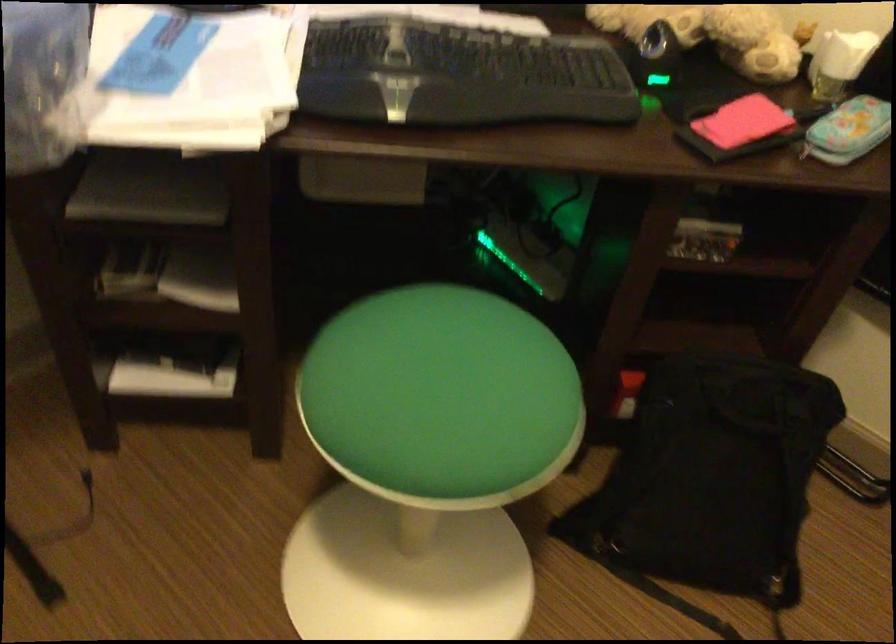
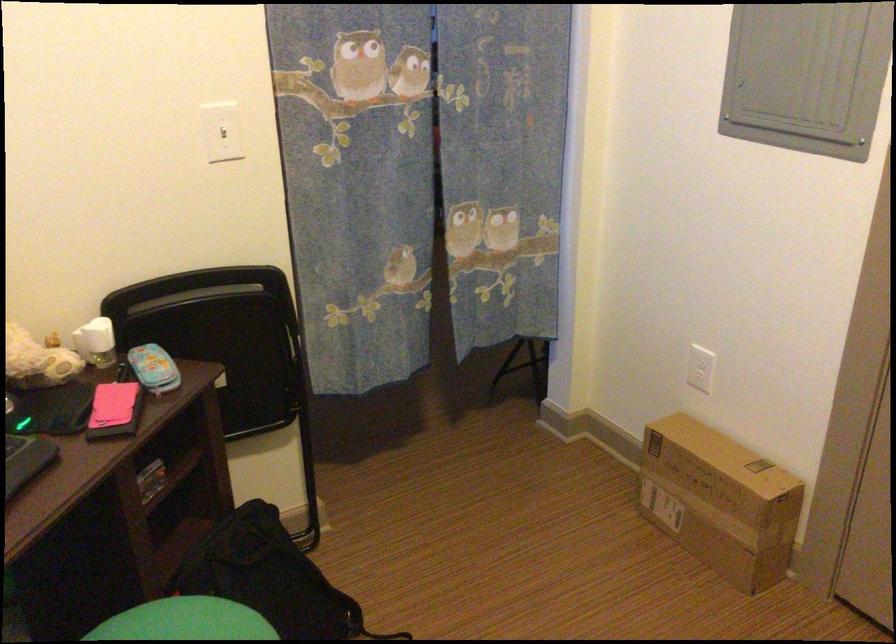
The point at (727, 446) is marked in the first image. Where is the corresponding point in the second image?

(270, 576)